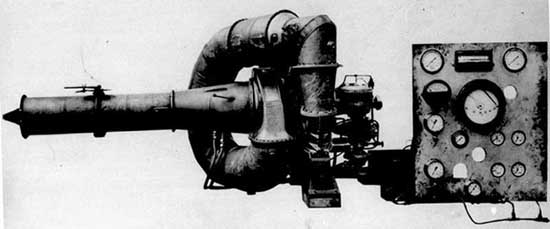
You are a GUI agent. You are given a task and a screenshot of the screen. Output one action in this format:
    pyautogui.click(x=<x>, y=<y>)
    Task: Click on the cabling
    This screenshot has height=229, width=550.
    Given the screenshot: What is the action you would take?
    [x=539, y=218]